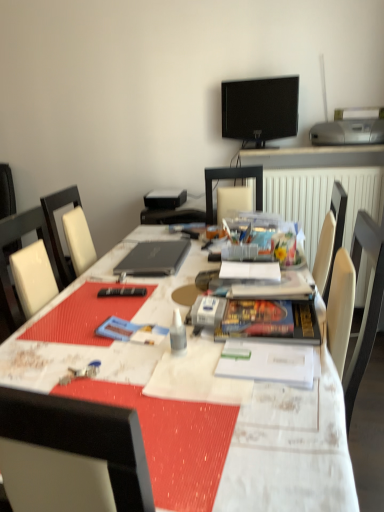
Looking at this image, measure the distance between point (165, 506) and camera.

A distance of 27.17 inches exists between point (165, 506) and camera.

Image resolution: width=384 pixels, height=512 pixels. Describe the element at coordinates (131, 331) in the screenshot. I see `blue matte paperback book at center, arranged as the second paperback book when viewed from the right` at that location.

You are a GUI agent. You are given a task and a screenshot of the screen. Output one action in this format:
    pyautogui.click(x=<x>, y=<y>)
    Task: Click on the hardcover book at center, arranged as the second paperback book when viewed from the left
    Image resolution: width=384 pixels, height=512 pixels.
    Given the screenshot: What is the action you would take?
    283,320

You are a GUI agent. You are given a task and a screenshot of the screen. Output one action in this format:
    pyautogui.click(x=<x>, y=<y>)
    Task: Click on the black glossy tv at upper center
    
    Given the screenshot: What is the action you would take?
    pyautogui.click(x=260, y=109)

The image size is (384, 512). Describe the element at coordinates (178, 335) in the screenshot. I see `white plastic glue at center` at that location.

What is the approximate width of white leather chair at left?

white leather chair at left is 67.71 centimeters in width.

The image size is (384, 512). What are the coordinates of `white textured table at center` in the screenshot? It's located at (291, 445).

Which is in front, point (254, 130) or point (13, 314)?

Positioned in front is point (13, 314).

Does black glossy tv at upper center have a greater height compared to white leather chair at left?

Answer: No.

From a real-world perspective, is black glossy tv at upper center below white leather chair at left?

Actually, black glossy tv at upper center is physically above white leather chair at left in the real world.

Considering their positions, is black glossy tv at upper center located in front of or behind white leather chair at left?

Clearly, black glossy tv at upper center is in front of white leather chair at left.

Considering the positions of point (6, 270) and point (158, 342), is point (6, 270) closer or farther from the camera than point (158, 342)?

Point (6, 270) appears to be farther away from the viewer than point (158, 342).

Considering the sizes of objects white leather chair at left and blue matte paperback book at center, arranged as the second paperback book when viewed from the right, in the image provided, who is smaller, white leather chair at left or blue matte paperback book at center, arranged as the second paperback book when viewed from the right,?

blue matte paperback book at center, arranged as the second paperback book when viewed from the right.

From the picture: From the image's perspective, is white leather chair at left located beneath blue matte paperback book at center, arranged as the second paperback book when viewed from the right?

Actually, white leather chair at left appears above blue matte paperback book at center, arranged as the second paperback book when viewed from the right, in the image.

Based on the photo, is white leather chair at left far away from blue matte paperback book at center, which ranks as the 1th paperback book in left-to-right order?

No, white leather chair at left is in close proximity to blue matte paperback book at center, which ranks as the 1th paperback book in left-to-right order.

Between white leather chair at left and black matte laptop at center, which one has less height?

black matte laptop at center.

In the scene shown: Is white leather chair at left not close to black matte laptop at center?

white leather chair at left is actually quite close to black matte laptop at center.

Is the depth of white leather chair at left greater than that of black matte laptop at center?

Yes, white leather chair at left is further from the viewer.

Considering the points (40, 221) and (151, 260), which point is behind, point (40, 221) or point (151, 260)?

Positioned behind is point (151, 260).

Is white textured table at center taller than black matte laptop at center?

Correct, white textured table at center is much taller as black matte laptop at center.

In the scene shown: Is white textured table at center to the right of black matte laptop at center from the viewer's perspective?

Correct, you'll find white textured table at center to the right of black matte laptop at center.

Are white textured table at center and black matte laptop at center far apart?

white textured table at center is near black matte laptop at center, not far away.

Does white textured table at center turn towards black matte laptop at center?

No, white textured table at center does not turn towards black matte laptop at center.

From the image's perspective, is black matte laptop at center below blue matte paperback book at center, arranged as the second paperback book when viewed from the right?

Result: No.

From their relative heights in the image, would you say black matte laptop at center is taller or shorter than blue matte paperback book at center, which ranks as the 1th paperback book in left-to-right order?

Considering their sizes, black matte laptop at center has more height than blue matte paperback book at center, which ranks as the 1th paperback book in left-to-right order.

Is blue matte paperback book at center, which ranks as the 1th paperback book in left-to-right order, completely or partially inside black matte laptop at center?

No.

Is white leather chair at left not within hardcover book at center, which ranks as the first paperback book in right-to-left order?

Absolutely, white leather chair at left is external to hardcover book at center, which ranks as the first paperback book in right-to-left order.

Looking at the image, does white leather chair at left seem bigger or smaller compared to hardcover book at center, arranged as the second paperback book when viewed from the left?

white leather chair at left is bigger than hardcover book at center, arranged as the second paperback book when viewed from the left.

Is white leather chair at left facing towards hardcover book at center, arranged as the second paperback book when viewed from the left?

No, white leather chair at left is not facing towards hardcover book at center, arranged as the second paperback book when viewed from the left.

Does white leather chair at left have a greater width compared to hardcover book at center, arranged as the second paperback book when viewed from the left?

Yes, white leather chair at left is wider than hardcover book at center, arranged as the second paperback book when viewed from the left.

Is silver metallic printer at upper right further to the viewer compared to black glossy tv at upper center?

No.

Between silver metallic printer at upper right and black glossy tv at upper center, which one has smaller width?

black glossy tv at upper center is thinner.

Consider the image. Is silver metallic printer at upper right with black glossy tv at upper center?

silver metallic printer at upper right and black glossy tv at upper center are clearly separated.

You are a GUI agent. You are given a task and a screenshot of the screen. Output one action in this format:
    pyautogui.click(x=<x>, y=<y>)
    Task: Click on the chair behind the black glossy tv at upper center
    Image resolution: width=384 pixels, height=512 pixels.
    Given the screenshot: What is the action you would take?
    pyautogui.click(x=27, y=267)

At what (x,y) coordinates should I click in order to perform the action: click on paperback book that is the 1st one when counting rightward from the white leather chair at left. Please return your answer as a coordinate pair (x, y). The image size is (384, 512). Looking at the image, I should click on (131, 331).

Which object lies further to the anchor point black matte laptop at center, silver metallic printer at upper right or white leather chair at left?

silver metallic printer at upper right is positioned further to the anchor black matte laptop at center.

When comparing their distances from white plastic glue at center, does black matte laptop at center or black glossy tv at upper center seem closer?

Based on the image, black matte laptop at center appears to be nearer to white plastic glue at center.

Based on their spatial positions, is silver metallic printer at upper right or white leather chair at left further from white textured table at center?

Based on the image, silver metallic printer at upper right appears to be further to white textured table at center.

Looking at this image, based on their spatial positions, is black glossy tv at upper center or hardcover book at center, arranged as the second paperback book when viewed from the left, closer to black matte laptop at center?

hardcover book at center, arranged as the second paperback book when viewed from the left.

From the image, which object appears to be nearer to black glossy tv at upper center, hardcover book at center, which ranks as the first paperback book in right-to-left order, or white plastic glue at center?

Based on the image, hardcover book at center, which ranks as the first paperback book in right-to-left order, appears to be nearer to black glossy tv at upper center.

Which object lies further to the anchor point hardcover book at center, arranged as the second paperback book when viewed from the left, silver metallic printer at upper right or white plastic glue at center?

The object further to hardcover book at center, arranged as the second paperback book when viewed from the left, is silver metallic printer at upper right.

Which object lies nearer to the anchor point hardcover book at center, arranged as the second paperback book when viewed from the left, black glossy tv at upper center or white leather chair at left?

The object closer to hardcover book at center, arranged as the second paperback book when viewed from the left, is white leather chair at left.

When comparing their distances from hardcover book at center, arranged as the second paperback book when viewed from the left, does white plastic glue at center or silver metallic printer at upper right seem further?

silver metallic printer at upper right lies further to hardcover book at center, arranged as the second paperback book when viewed from the left, than the other object.

Find the location of `stationery positioned between white textured table at center and black glossy tv at upper center from near to far`. stationery positioned between white textured table at center and black glossy tv at upper center from near to far is located at coordinates (178, 335).

Find the location of a particular element. Image resolution: width=384 pixels, height=512 pixels. stationery positioned between white textured table at center and blue matte paperback book at center, which ranks as the 1th paperback book in left-to-right order, from near to far is located at coordinates (178, 335).

Where is `laptop situated between blue matte paperback book at center, which ranks as the 1th paperback book in left-to-right order, and silver metallic printer at upper right from left to right`? laptop situated between blue matte paperback book at center, which ranks as the 1th paperback book in left-to-right order, and silver metallic printer at upper right from left to right is located at coordinates (154, 258).

The height and width of the screenshot is (512, 384). I want to click on laptop positioned between hardcover book at center, which ranks as the first paperback book in right-to-left order, and black glossy tv at upper center from near to far, so pos(154,258).